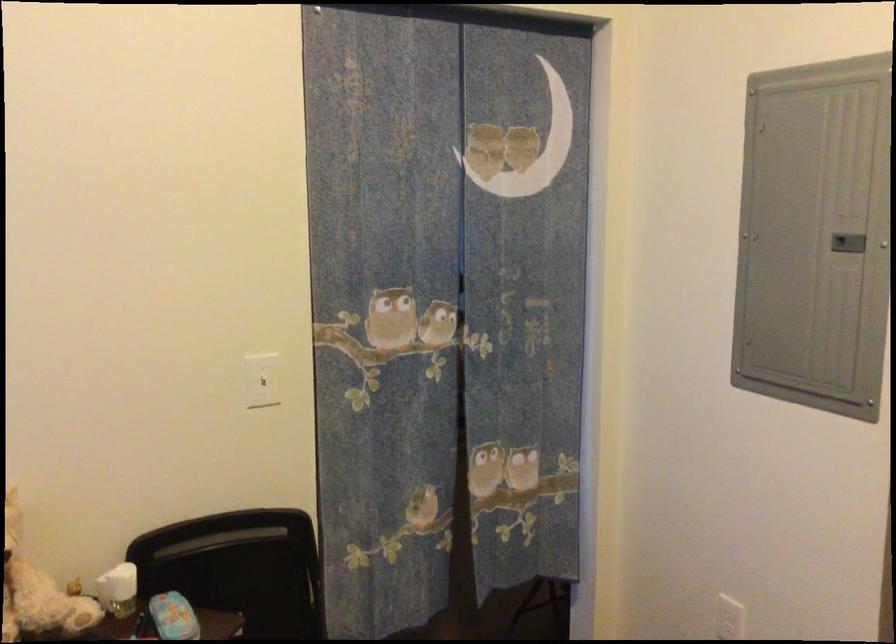
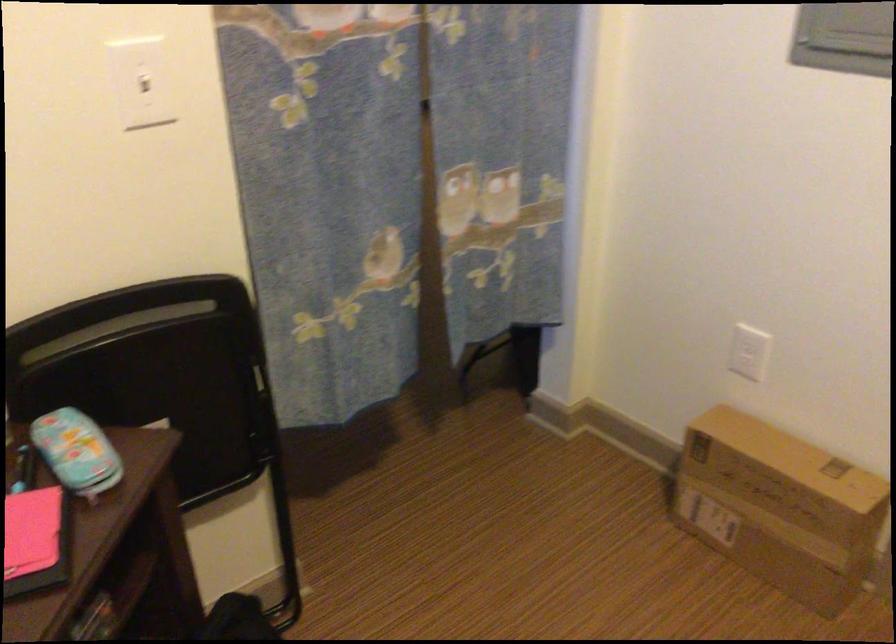
Question: How did the camera likely rotate?

Choices:
 (A) Left
 (B) Right
 (C) Up
 (D) Down

Answer: (D)